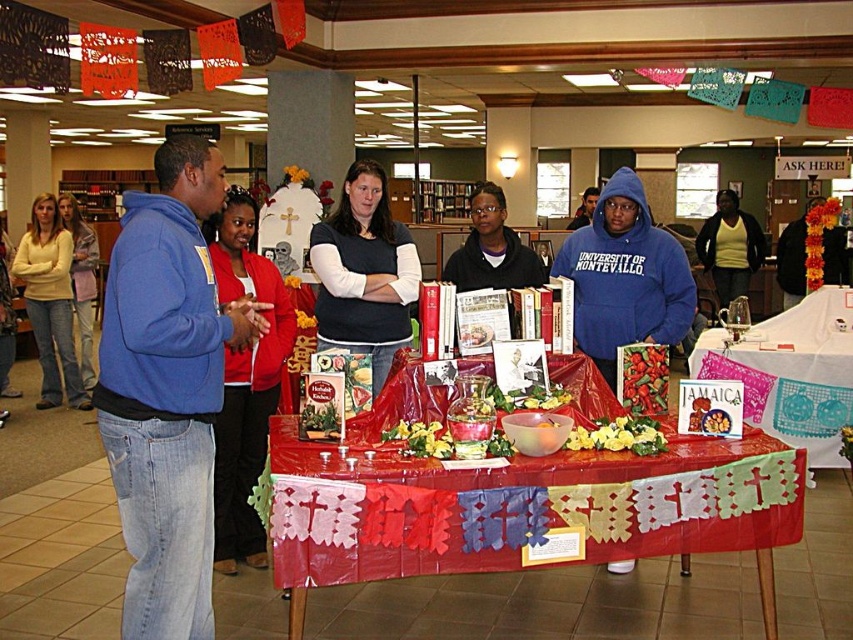
You are standing in the library and see the point at coordinates point [524,509]. Is this point located on the red plastic table at center?

Yes, the point [524,509] is on the red plastic table at center according to the description.

You are standing at the entrance of the room and want to find the red plastic table at center. According to the coordinates provided, in which direction should you move relative to your current position?

The red plastic table at center is located at coordinates point (x=524, y=509), so you should move towards the center of the room to reach it.